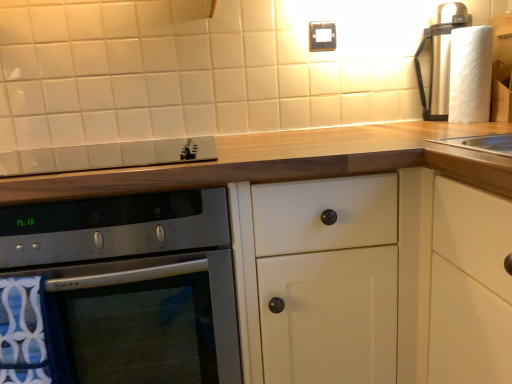
Question: From the image's perspective, is white textured paper towel at upper right on gold metallic electric outlet at upper center?

Choices:
 (A) yes
 (B) no

Answer: (B)

Question: Are white textured paper towel at upper right and gold metallic electric outlet at upper center far apart?

Choices:
 (A) yes
 (B) no

Answer: (B)

Question: Is white textured paper towel at upper right further to camera compared to gold metallic electric outlet at upper center?

Choices:
 (A) yes
 (B) no

Answer: (B)

Question: Considering the relative positions of white textured paper towel at upper right and gold metallic electric outlet at upper center in the image provided, is white textured paper towel at upper right to the right of gold metallic electric outlet at upper center from the viewer's perspective?

Choices:
 (A) no
 (B) yes

Answer: (B)

Question: Is white textured paper towel at upper right oriented away from gold metallic electric outlet at upper center?

Choices:
 (A) no
 (B) yes

Answer: (A)

Question: Is white textured paper towel at upper right beside gold metallic electric outlet at upper center?

Choices:
 (A) yes
 (B) no

Answer: (B)

Question: Is satin silver oven at lower left not within white matte cabinet at center?

Choices:
 (A) no
 (B) yes

Answer: (A)

Question: Does satin silver oven at lower left appear on the left side of white matte cabinet at center?

Choices:
 (A) yes
 (B) no

Answer: (A)

Question: Could you tell me if satin silver oven at lower left is facing white matte cabinet at center?

Choices:
 (A) no
 (B) yes

Answer: (B)

Question: Does satin silver oven at lower left appear on the right side of white matte cabinet at center?

Choices:
 (A) no
 (B) yes

Answer: (A)

Question: Is satin silver oven at lower left placed right next to white matte cabinet at center?

Choices:
 (A) yes
 (B) no

Answer: (B)

Question: Is satin silver oven at lower left closer to the viewer compared to white matte cabinet at center?

Choices:
 (A) yes
 (B) no

Answer: (A)

Question: Is the surface of satin silver gas stove at upper center in direct contact with satin silver oven at lower left?

Choices:
 (A) no
 (B) yes

Answer: (A)